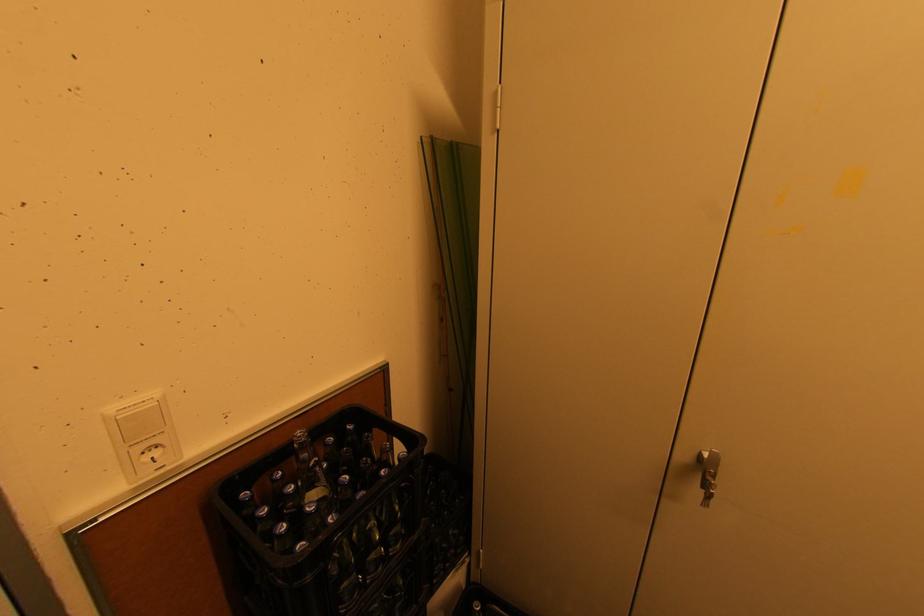
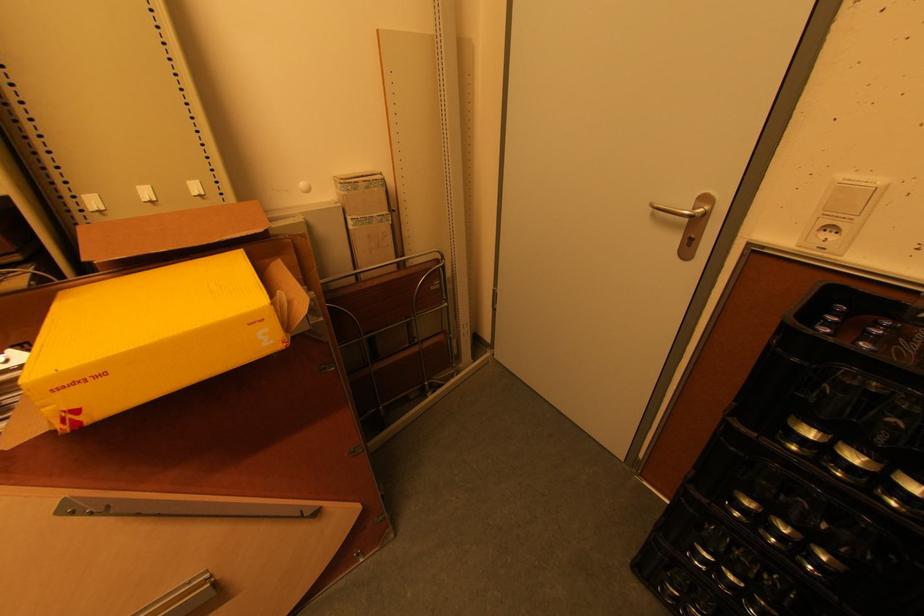
The images are taken continuously from a first-person perspective. In which direction is your viewpoint rotating?

The camera rotated toward left-down.